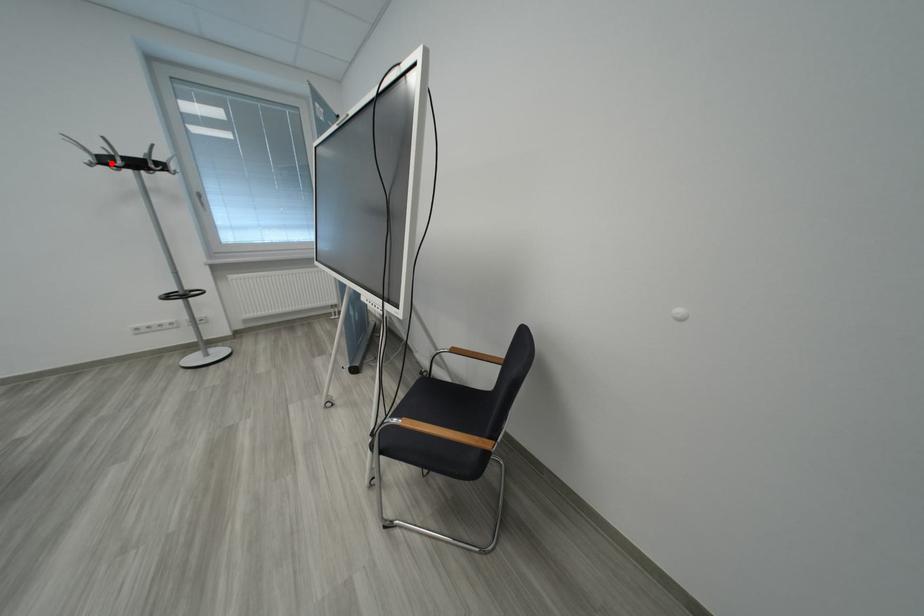
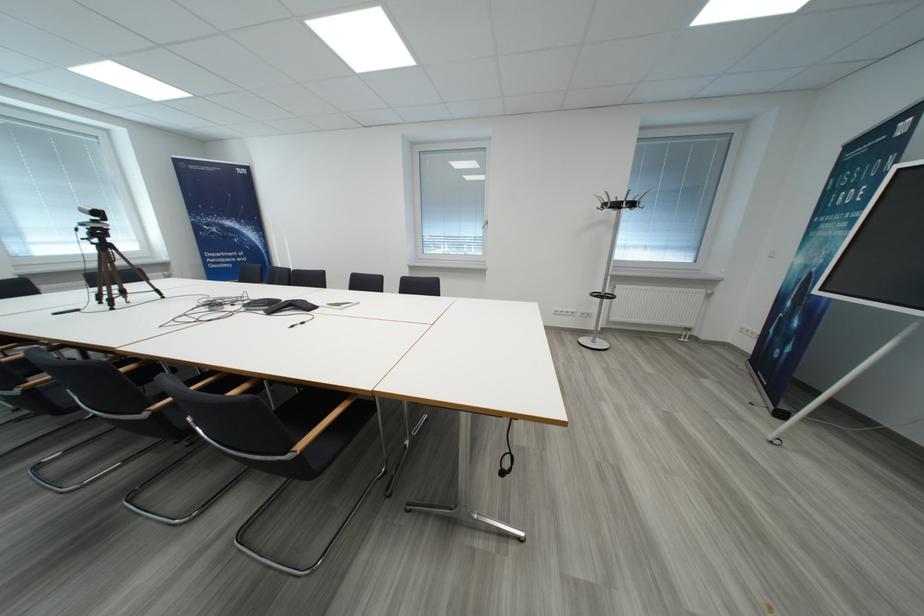
Where in the second image is the point corresponding to the highlighted location from the first image?

(623, 208)